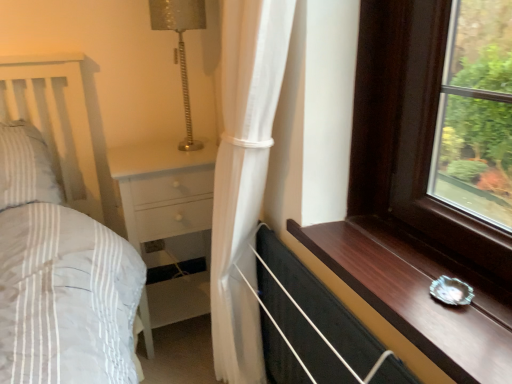
Question: Is white wood chest of drawers at center next to white sheer curtain at center?

Choices:
 (A) no
 (B) yes

Answer: (A)

Question: Are white wood chest of drawers at center and white sheer curtain at center far apart?

Choices:
 (A) yes
 (B) no

Answer: (B)

Question: Is white sheer curtain at center inside white wood chest of drawers at center?

Choices:
 (A) yes
 (B) no

Answer: (B)

Question: Is white wood chest of drawers at center oriented away from white sheer curtain at center?

Choices:
 (A) yes
 (B) no

Answer: (B)

Question: Considering the relative positions of white wood chest of drawers at center and white sheer curtain at center in the image provided, is white wood chest of drawers at center to the right of white sheer curtain at center from the viewer's perspective?

Choices:
 (A) yes
 (B) no

Answer: (B)

Question: From a real-world perspective, is white wood chest of drawers at center physically below white sheer curtain at center?

Choices:
 (A) yes
 (B) no

Answer: (A)

Question: Could you tell me if white sheer curtain at center is turned towards white wood chest of drawers at center?

Choices:
 (A) yes
 (B) no

Answer: (B)

Question: From the image's perspective, is white sheer curtain at center beneath white wood chest of drawers at center?

Choices:
 (A) yes
 (B) no

Answer: (B)

Question: Does white sheer curtain at center appear on the left side of white wood chest of drawers at center?

Choices:
 (A) no
 (B) yes

Answer: (A)

Question: Considering the relative sizes of white sheer curtain at center and white wood chest of drawers at center in the image provided, is white sheer curtain at center smaller than white wood chest of drawers at center?

Choices:
 (A) no
 (B) yes

Answer: (B)

Question: Is white sheer curtain at center closer to camera compared to white wood chest of drawers at center?

Choices:
 (A) no
 (B) yes

Answer: (B)

Question: Is white sheer curtain at center looking in the opposite direction of white wood chest of drawers at center?

Choices:
 (A) no
 (B) yes

Answer: (A)

Question: Does dark wood window sill at lower right have a lesser height compared to white wood chest of drawers at center?

Choices:
 (A) yes
 (B) no

Answer: (A)